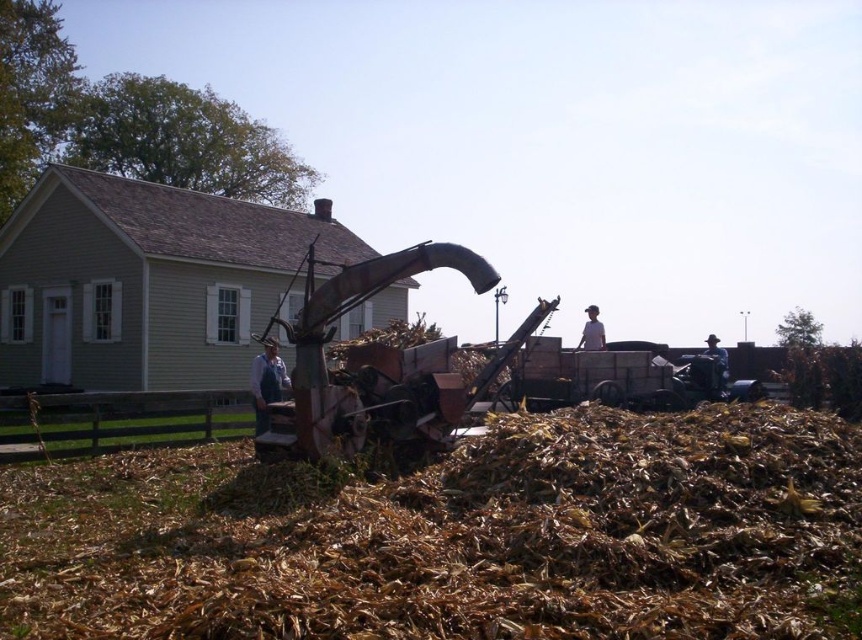
Is point (263, 401) behind point (723, 388)?

That is False.

Which is below, denim overalls at center or brown leather hat at right?

brown leather hat at right is lower down.

Is point (266, 352) positioned in front of point (715, 368)?

Yes.

Where is `denim overalls at center`? denim overalls at center is located at coordinates (267, 381).

Does brown dry hay at center come in front of brown leather hat at right?

Yes, it is.

Who is higher up, brown dry hay at center or brown leather hat at right?

brown leather hat at right is above.

Is point (526, 476) positioned in front of point (715, 340)?

That is True.

This screenshot has height=640, width=862. Identify the location of brown dry hay at center. (454, 536).

Can you confirm if brown dry hay at center is shorter than white cloth hat at upper right?

Yes, brown dry hay at center is shorter than white cloth hat at upper right.

Describe the element at coordinates (454, 536) in the screenshot. The image size is (862, 640). I see `brown dry hay at center` at that location.

Which is behind, point (804, 481) or point (598, 339)?

The point (598, 339) is more distant.

The width and height of the screenshot is (862, 640). Find the location of `brown dry hay at center`. brown dry hay at center is located at coordinates (454, 536).